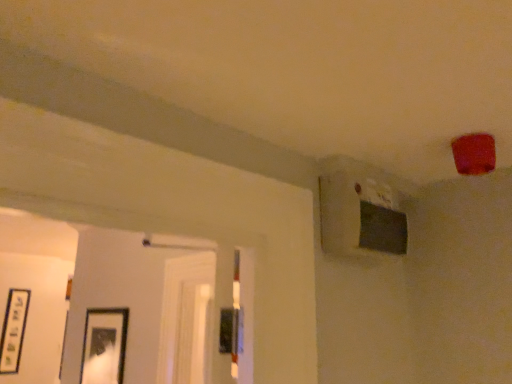
Question: Is there a large distance between matte black picture frame at lower left, which is counted as the 1th picture frame, starting from the front, and black matte picture frame at lower left, the first picture frame in the back-to-front sequence?

Choices:
 (A) yes
 (B) no

Answer: (A)

Question: Considering the relative sizes of matte black picture frame at lower left, positioned as the 1th picture frame in top-to-bottom order, and black matte picture frame at lower left, the first picture frame from the bottom, in the image provided, is matte black picture frame at lower left, positioned as the 1th picture frame in top-to-bottom order, bigger than black matte picture frame at lower left, the first picture frame from the bottom,?

Choices:
 (A) no
 (B) yes

Answer: (B)

Question: Is matte black picture frame at lower left, positioned as the 1th picture frame in top-to-bottom order, smaller than black matte picture frame at lower left, placed as the second picture frame when sorted from right to left?

Choices:
 (A) no
 (B) yes

Answer: (A)

Question: From the image's perspective, is matte black picture frame at lower left, the 2th picture frame when ordered from left to right, above black matte picture frame at lower left, the first picture frame in the back-to-front sequence?

Choices:
 (A) no
 (B) yes

Answer: (B)

Question: Considering the relative positions of matte black picture frame at lower left, the 1th picture frame when ordered from right to left, and black matte picture frame at lower left, arranged as the first picture frame when viewed from the left, in the image provided, is matte black picture frame at lower left, the 1th picture frame when ordered from right to left, to the left of black matte picture frame at lower left, arranged as the first picture frame when viewed from the left, from the viewer's perspective?

Choices:
 (A) yes
 (B) no

Answer: (B)

Question: From a real-world perspective, is matte black picture frame at lower left, the 2th picture frame when ordered from left to right, physically below black matte picture frame at lower left, the first picture frame in the back-to-front sequence?

Choices:
 (A) no
 (B) yes

Answer: (B)

Question: Does black matte picture frame at lower left, placed as the second picture frame when sorted from right to left, appear on the left side of matte black picture frame at lower left, the 2th picture frame when ordered from left to right?

Choices:
 (A) no
 (B) yes

Answer: (B)

Question: Are black matte picture frame at lower left, the first picture frame in the back-to-front sequence, and matte black picture frame at lower left, which is counted as the 1th picture frame, starting from the front, far apart?

Choices:
 (A) no
 (B) yes

Answer: (B)

Question: Can you confirm if black matte picture frame at lower left, placed as the second picture frame when sorted from right to left, is smaller than matte black picture frame at lower left, the 1th picture frame when ordered from right to left?

Choices:
 (A) no
 (B) yes

Answer: (B)

Question: Could you tell me if black matte picture frame at lower left, the first picture frame from the bottom, is facing matte black picture frame at lower left, which is counted as the 2th picture frame, starting from the back?

Choices:
 (A) yes
 (B) no

Answer: (A)

Question: Is black matte picture frame at lower left, which appears as the 2th picture frame when viewed from the front, touching matte black picture frame at lower left, placed as the 2th picture frame when sorted from bottom to top?

Choices:
 (A) yes
 (B) no

Answer: (B)

Question: From the image's perspective, is black matte picture frame at lower left, placed as the second picture frame when sorted from right to left, under matte black picture frame at lower left, placed as the 2th picture frame when sorted from bottom to top?

Choices:
 (A) no
 (B) yes

Answer: (B)

Question: From a real-world perspective, is matte black picture frame at lower left, which is counted as the 2th picture frame, starting from the back, physically located above or below black matte picture frame at lower left, marked as the 2th picture frame in a top-to-bottom arrangement?

Choices:
 (A) below
 (B) above

Answer: (A)